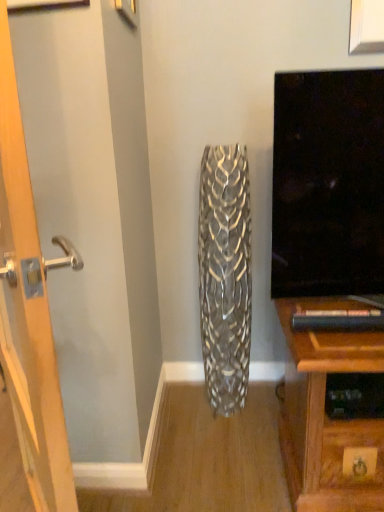
This screenshot has height=512, width=384. What do you see at coordinates (225, 275) in the screenshot?
I see `silver metallic vase at center` at bounding box center [225, 275].

I want to click on silver metallic vase at center, so click(225, 275).

Image resolution: width=384 pixels, height=512 pixels. Describe the element at coordinates (28, 311) in the screenshot. I see `wooden door at left` at that location.

Identify the location of wooden door at left. (28, 311).

Measure the distance between wooden door at left and camera.

A distance of 45.80 centimeters exists between wooden door at left and camera.

Image resolution: width=384 pixels, height=512 pixels. Find the location of `silver metallic vase at center`. silver metallic vase at center is located at coordinates (225, 275).

Considering the positions of objects silver metallic vase at center and wooden door at left in the image provided, who is more to the right, silver metallic vase at center or wooden door at left?

Positioned to the right is silver metallic vase at center.

Between silver metallic vase at center and wooden door at left, which one is positioned behind?

Positioned behind is silver metallic vase at center.

Which is behind, point (240, 408) or point (0, 340)?

The point (240, 408) is more distant.

From the image's perspective, who appears lower, silver metallic vase at center or wooden door at left?

From the image's view, wooden door at left is below.

Consider the image. From a real-world perspective, is silver metallic vase at center physically located above or below wooden door at left?

Clearly, from a real-world perspective, silver metallic vase at center is below wooden door at left.

In terms of width, does silver metallic vase at center look wider or thinner when compared to wooden door at left?

Clearly, silver metallic vase at center has more width compared to wooden door at left.

Considering the relative sizes of silver metallic vase at center and wooden door at left in the image provided, is silver metallic vase at center taller than wooden door at left?

Incorrect, the height of silver metallic vase at center is not larger of that of wooden door at left.

In the scene shown: Between silver metallic vase at center and wooden door at left, which one has larger size?

wooden door at left.

Would you say silver metallic vase at center is inside or outside wooden door at left?

silver metallic vase at center is not inside wooden door at left, it's outside.

Are silver metallic vase at center and wooden door at left beside each other?

No.

Is silver metallic vase at center aimed at wooden door at left?

No, silver metallic vase at center is not aimed at wooden door at left.

How different are the orientations of silver metallic vase at center and wooden door at left in degrees?

The facing directions of silver metallic vase at center and wooden door at left are 53.7 degrees apart.

At what (x,y) coordinates should I click in order to perform the action: click on door on the left of silver metallic vase at center. Please return your answer as a coordinate pair (x, y). Looking at the image, I should click on (28, 311).

Between wooden door at left and silver metallic vase at center, which one appears on the left side from the viewer's perspective?

From the viewer's perspective, wooden door at left appears more on the left side.

In the scene shown: Between wooden door at left and silver metallic vase at center, which one is positioned behind?

silver metallic vase at center.

Which is closer, (19, 358) or (249, 208)?

Point (19, 358) is closer to the camera than point (249, 208).

From the image's perspective, is wooden door at left below silver metallic vase at center?

Yes, from the image's perspective, wooden door at left is beneath silver metallic vase at center.

From a real-world perspective, is wooden door at left on top of silver metallic vase at center?

Yes, from a real-world perspective, wooden door at left is on top of silver metallic vase at center.

Is wooden door at left wider or thinner than silver metallic vase at center?

wooden door at left is thinner than silver metallic vase at center.

Considering the relative sizes of wooden door at left and silver metallic vase at center in the image provided, is wooden door at left shorter than silver metallic vase at center?

No.

Considering the sizes of wooden door at left and silver metallic vase at center in the image, is wooden door at left bigger or smaller than silver metallic vase at center?

In the image, wooden door at left appears to be larger than silver metallic vase at center.

Is wooden door at left not inside silver metallic vase at center?

Absolutely, wooden door at left is external to silver metallic vase at center.

Is wooden door at left in contact with silver metallic vase at center?

No, wooden door at left is not in contact with silver metallic vase at center.

Is wooden door at left aimed at silver metallic vase at center?

No, wooden door at left is not aimed at silver metallic vase at center.

How different are the orientations of wooden door at left and silver metallic vase at center in degrees?

The angular difference between wooden door at left and silver metallic vase at center is 53.7 degrees.

Where is `vase to the right of wooden door at left`? vase to the right of wooden door at left is located at coordinates (225, 275).

Locate an element on the screen. This screenshot has height=512, width=384. vase to the right of wooden door at left is located at coordinates (225, 275).

This screenshot has width=384, height=512. What are the coordinates of `door on the left of silver metallic vase at center` in the screenshot? It's located at (28, 311).